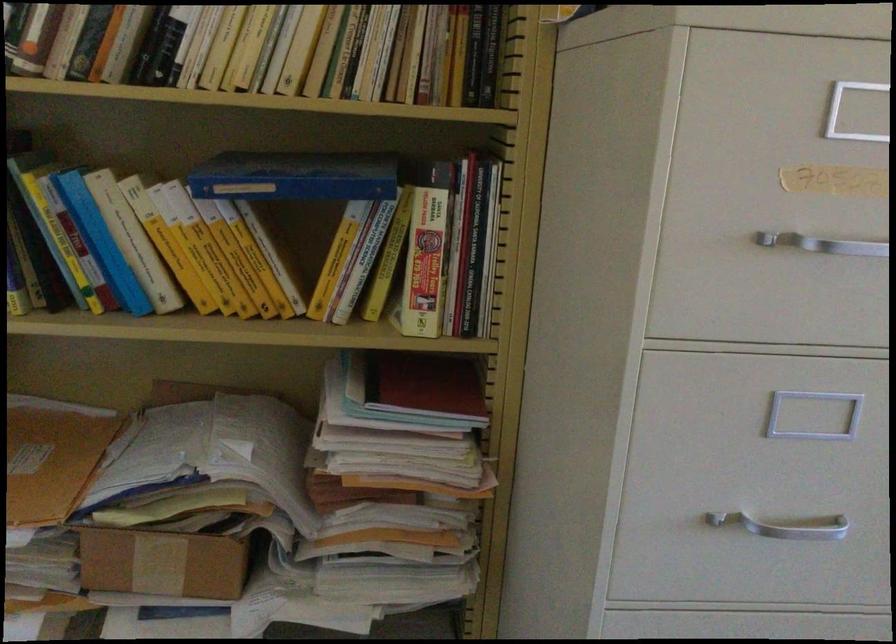
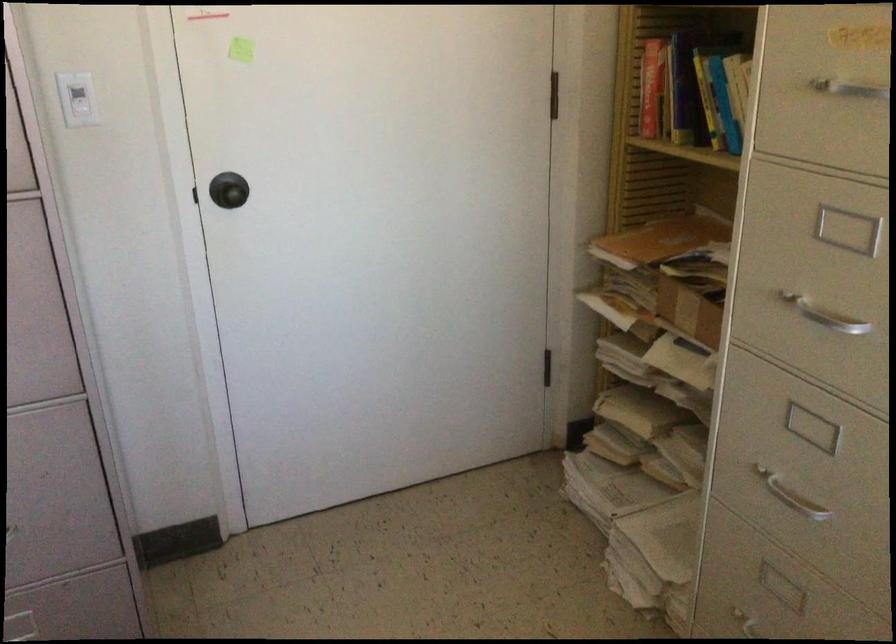
Locate, in the second image, the point that corresponds to [764,512] in the first image.

(824, 315)